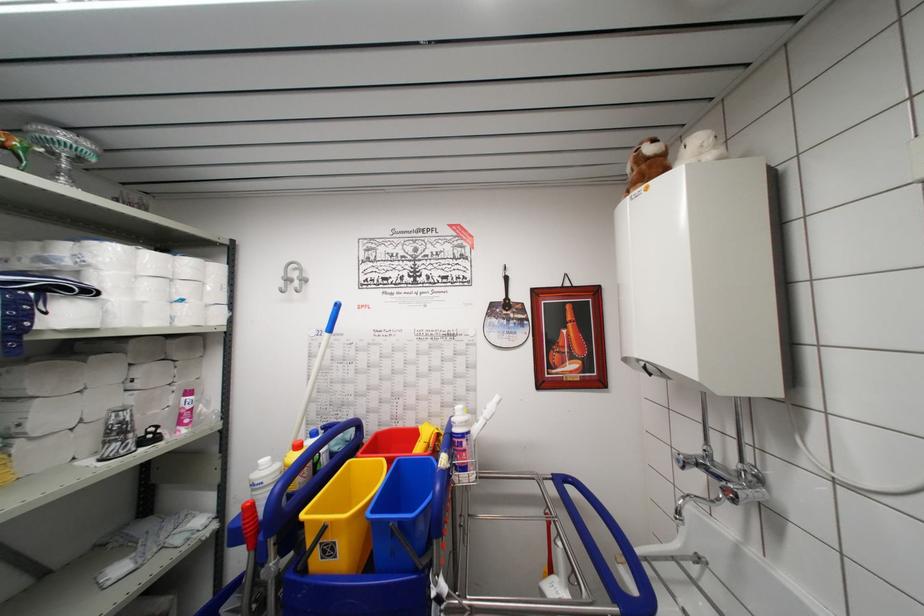
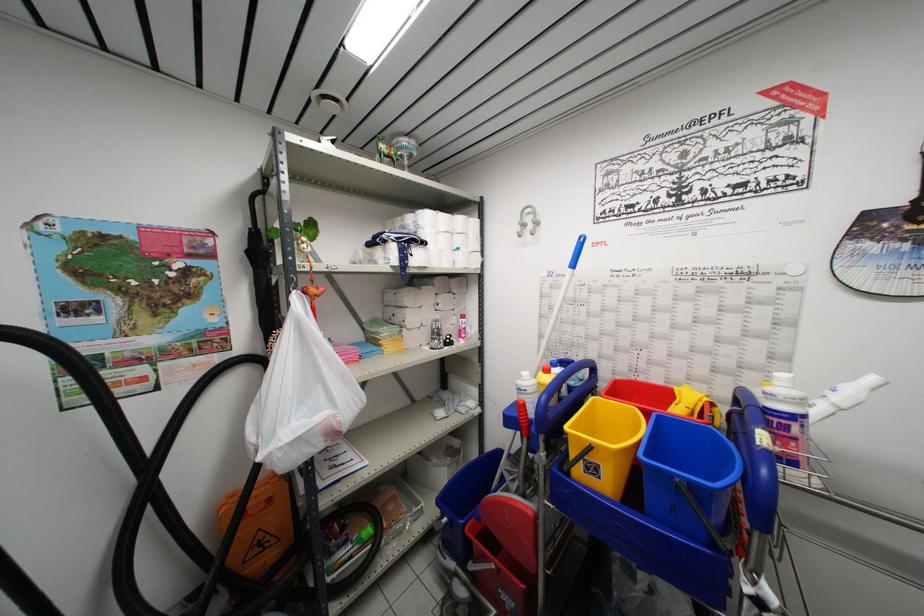
The point at (259, 522) is marked in the first image. Where is the corresponding point in the second image?

(530, 419)